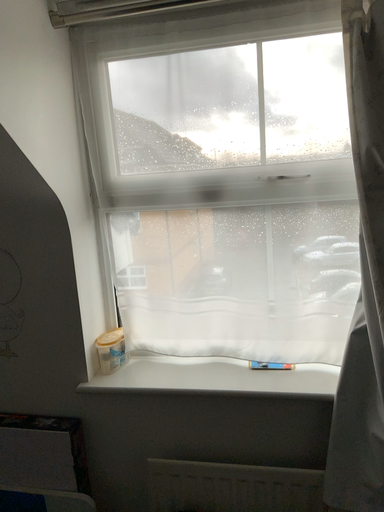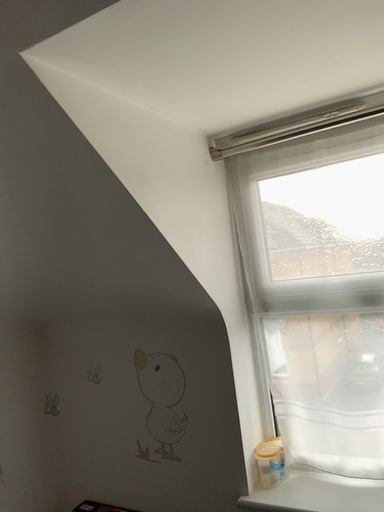
Question: How did the camera likely rotate when shooting the video?

Choices:
 (A) rotated upward
 (B) rotated downward

Answer: (A)